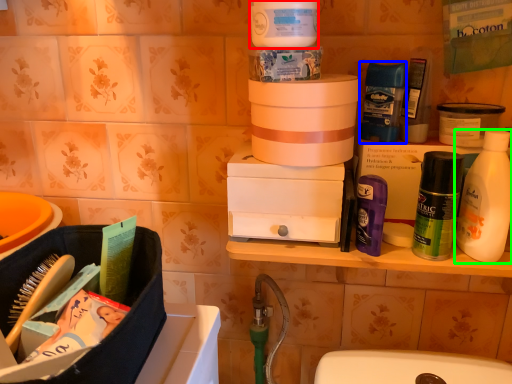
Question: Considering the real-world distances, which object is closest to cleaning product (highlighted by a red box)? toiletry (highlighted by a blue box) or bottle (highlighted by a green box).

Choices:
 (A) toiletry
 (B) bottle

Answer: (A)